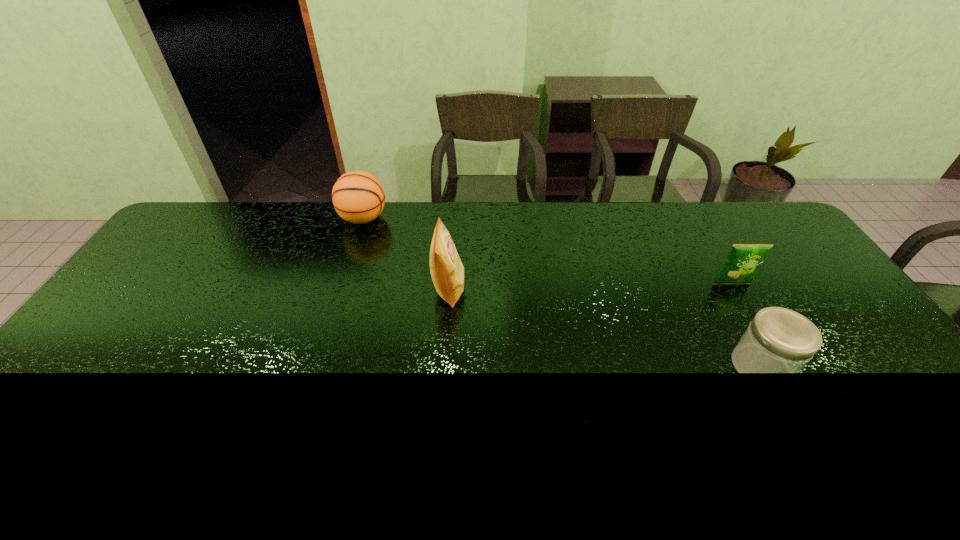
At what (x,y) coordinates should I click in order to perform the action: click on the tallest object. Please return your answer as a coordinate pair (x, y). This screenshot has width=960, height=540. Looking at the image, I should click on (447, 271).

Where is `the second object from left to right`? This screenshot has height=540, width=960. the second object from left to right is located at coordinates (447, 271).

At what (x,y) coordinates should I click in order to perform the action: click on basketball. Please return your answer as a coordinate pair (x, y). The image size is (960, 540). Looking at the image, I should click on (358, 197).

The height and width of the screenshot is (540, 960). Identify the location of the leftmost object. (358, 197).

The height and width of the screenshot is (540, 960). In order to click on the right crisp (potato chip) in this screenshot , I will do `click(744, 260)`.

Where is `jar`? The image size is (960, 540). jar is located at coordinates (778, 340).

Where is `vacant space located on the front-facing side of the second object from left to right`? This screenshot has height=540, width=960. vacant space located on the front-facing side of the second object from left to right is located at coordinates (573, 289).

Identify the location of vacant region located on the left of the basketball. The image size is (960, 540). (237, 219).

The image size is (960, 540). I want to click on vacant space located on the front-facing side of the shorter crisp (potato chip), so coord(780,366).

Find the location of a particular element. The width and height of the screenshot is (960, 540). free region located 0.070m on the back of the jar is located at coordinates (737, 325).